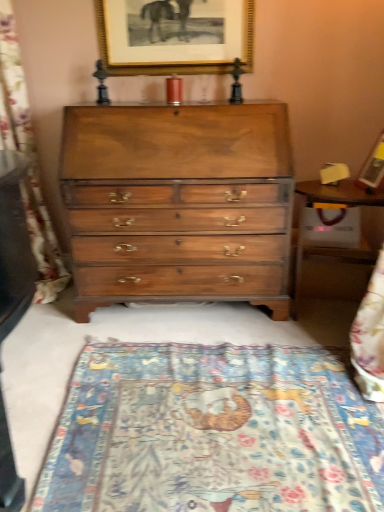
You are a GUI agent. You are given a task and a screenshot of the screen. Output one action in this format:
    pyautogui.click(x=<x>, y=<y>)
    Task: Click on the vacant region to the left of wooden table at right
    The image size is (384, 512).
    Given the screenshot: What is the action you would take?
    pyautogui.click(x=251, y=327)